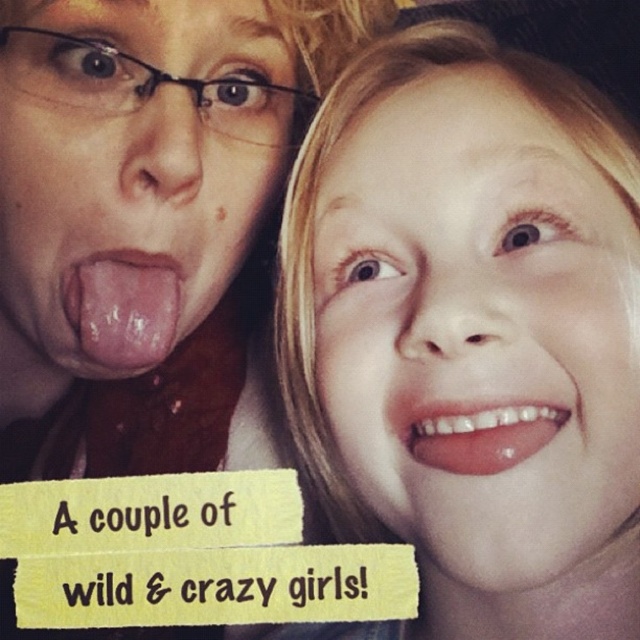
Question: Can you confirm if pink flesh tongue at center is positioned above pink glossy lips at lower right?

Choices:
 (A) yes
 (B) no

Answer: (A)

Question: Which point is closer to the camera taking this photo?

Choices:
 (A) (480, 454)
 (B) (122, 355)
 (C) (250, 56)
 (D) (420, 472)

Answer: (A)

Question: Which point appears farthest from the camera in this image?

Choices:
 (A) (168, 285)
 (B) (404, 433)
 (C) (516, 289)

Answer: (A)

Question: In this image, where is smooth skin face at upper right located relative to pink glossy lips at lower right?

Choices:
 (A) above
 (B) below

Answer: (A)

Question: Can you confirm if pink flesh at center is positioned to the left of pink flesh tongue at center?

Choices:
 (A) no
 (B) yes

Answer: (B)

Question: Which of the following is the closest to the observer?

Choices:
 (A) pink flesh tongue at center
 (B) pink flesh at center

Answer: (B)